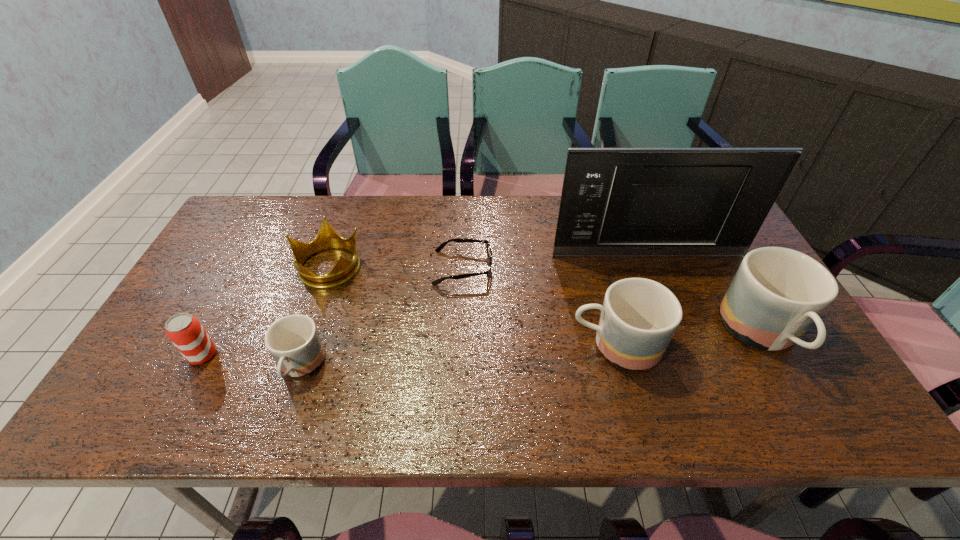
Where is `the leftmost mug`? The image size is (960, 540). the leftmost mug is located at coordinates (293, 341).

Locate an element on the screen. This screenshot has height=540, width=960. the second mug from right to left is located at coordinates (639, 316).

Image resolution: width=960 pixels, height=540 pixels. What are the coordinates of `the third tallest object` in the screenshot? It's located at (639, 316).

I want to click on the rightmost mug, so click(x=777, y=293).

Locate an element on the screen. This screenshot has height=540, width=960. the tallest object is located at coordinates (624, 202).

Where is `crown`? The width and height of the screenshot is (960, 540). crown is located at coordinates (327, 238).

Locate an element on the screen. This screenshot has width=960, height=540. the fourth object from right to left is located at coordinates (459, 240).

Where is `the shortest object`? the shortest object is located at coordinates (459, 240).

Where is `beer can`? This screenshot has height=540, width=960. beer can is located at coordinates 187,334.

At what (x,y) coordinates should I click in order to perform the action: click on vacant space located 0.190m on the side with the handle of the second tallest mug. Please return your answer as a coordinate pair (x, y). The image size is (960, 540). Looking at the image, I should click on (491, 346).